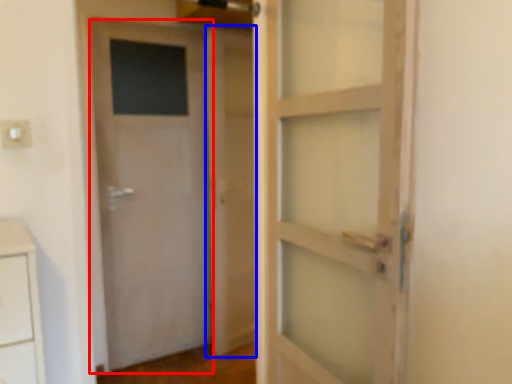
Question: Among these objects, which one is farthest to the camera, door (highlighted by a red box) or barn door (highlighted by a blue box)?

Choices:
 (A) door
 (B) barn door

Answer: (B)